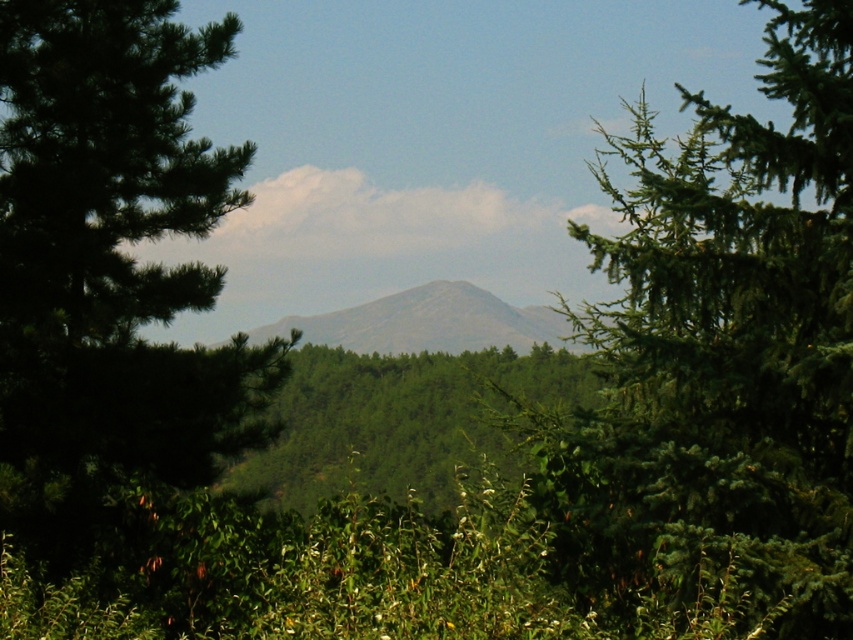
Who is positioned more to the right, green needle-like at right or green matte tree at left?

From the viewer's perspective, green needle-like at right appears more on the right side.

Locate an element on the screen. This screenshot has width=853, height=640. green needle-like at right is located at coordinates (718, 365).

Between point (532, 456) and point (27, 163), which one is positioned in front?

Point (532, 456)

I want to click on green needle-like at right, so [x=718, y=365].